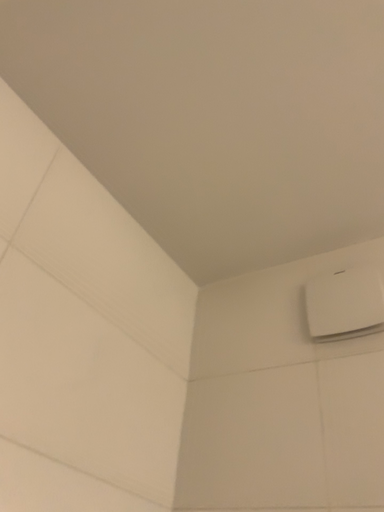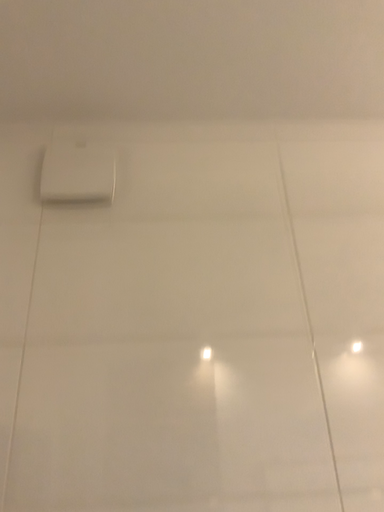
Question: How did the camera likely rotate when shooting the video?

Choices:
 (A) rotated right
 (B) rotated left

Answer: (A)